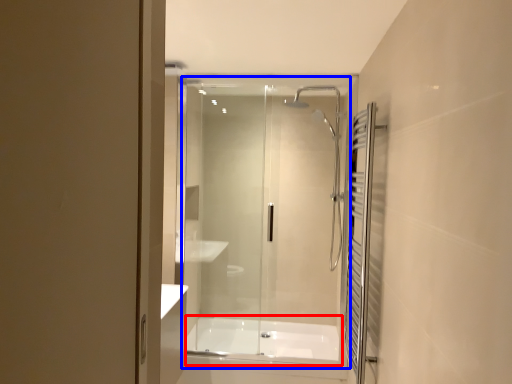
Question: Which of the following is the closest to the observer, bath (highlighted by a red box) or glass door (highlighted by a blue box)?

Choices:
 (A) bath
 (B) glass door

Answer: (B)